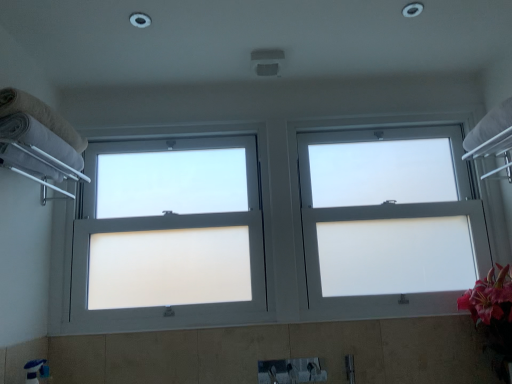
This screenshot has width=512, height=384. What are the coordinates of `white frosted glass window at center, the 2th window when ordered from left to right` in the screenshot? It's located at (392, 232).

Describe the element at coordinates (392, 232) in the screenshot. I see `white frosted glass window at center, the 2th window when ordered from left to right` at that location.

What do you see at coordinates (40, 115) in the screenshot? I see `beige cotton towel at left, positioned as the 2th towel in bottom-to-top order` at bounding box center [40, 115].

The height and width of the screenshot is (384, 512). I want to click on white frosted glass window at center, the 1th window viewed from the left, so click(170, 250).

At what (x,y) coordinates should I click in order to perform the action: click on white fluffy towel at left, the second towel from the top. Please return your answer as a coordinate pair (x, y). Looking at the image, I should click on (40, 140).

Is beige cotton towel at left, arranged as the 1th towel when viewed from the top, at the right side of white frosted glass window at center, which is the first window from right to left?

Incorrect, beige cotton towel at left, arranged as the 1th towel when viewed from the top, is not on the right side of white frosted glass window at center, which is the first window from right to left.

From a real-world perspective, is beige cotton towel at left, arranged as the 1th towel when viewed from the top, below white frosted glass window at center, the 2th window when ordered from left to right?

No, from a real-world perspective, beige cotton towel at left, arranged as the 1th towel when viewed from the top, is not below white frosted glass window at center, the 2th window when ordered from left to right.

Is point (60, 126) positioned in front of point (436, 184)?

Yes, it is.

Considering the sizes of objects beige cotton towel at left, arranged as the 1th towel when viewed from the top, and white frosted glass window at center, the 2th window when ordered from left to right, in the image provided, who is smaller, beige cotton towel at left, arranged as the 1th towel when viewed from the top, or white frosted glass window at center, the 2th window when ordered from left to right,?

With smaller size is beige cotton towel at left, arranged as the 1th towel when viewed from the top.

From the image's perspective, which one is positioned higher, white fluffy towel at left, the second towel from the top, or beige cotton towel at left, arranged as the 1th towel when viewed from the top?

beige cotton towel at left, arranged as the 1th towel when viewed from the top, from the image's perspective.

From a real-world perspective, is white fluffy towel at left, the first towel positioned from the bottom, over beige cotton towel at left, arranged as the 1th towel when viewed from the top?

No, from a real-world perspective, white fluffy towel at left, the first towel positioned from the bottom, is not over beige cotton towel at left, arranged as the 1th towel when viewed from the top

Considering the points (26, 137) and (10, 94), which point is in front, point (26, 137) or point (10, 94)?

The point (10, 94) is closer to the camera.

There is a beige cotton towel at left, arranged as the 1th towel when viewed from the top. Identify the location of the 1st window below it (from a real-world perspective). (170, 250).

Would you say beige cotton towel at left, arranged as the 1th towel when viewed from the top, is inside or outside white frosted glass window at center, the 1th window viewed from the left?

beige cotton towel at left, arranged as the 1th towel when viewed from the top, is not enclosed by white frosted glass window at center, the 1th window viewed from the left.

Based on their sizes in the image, would you say beige cotton towel at left, positioned as the 2th towel in bottom-to-top order, is bigger or smaller than white frosted glass window at center, the 1th window viewed from the left?

Clearly, beige cotton towel at left, positioned as the 2th towel in bottom-to-top order, is smaller in size than white frosted glass window at center, the 1th window viewed from the left.

Considering the positions of objects beige cotton towel at left, positioned as the 2th towel in bottom-to-top order, and white frosted glass window at center, the 1th window viewed from the left, in the image provided, who is in front, beige cotton towel at left, positioned as the 2th towel in bottom-to-top order, or white frosted glass window at center, the 1th window viewed from the left,?

beige cotton towel at left, positioned as the 2th towel in bottom-to-top order, is more forward.

This screenshot has width=512, height=384. What are the coordinates of `window lying below the white frosted glass window at center, the 2th window when ordered from left to right (from the image's perspective)` in the screenshot? It's located at (170, 250).

Could you tell me if white frosted glass window at center, which is the 2th window in right-to-left order, is turned towards white frosted glass window at center, the 2th window when ordered from left to right?

No.

Consider the image. From a real-world perspective, is white frosted glass window at center, which is the 2th window in right-to-left order, positioned above or below white frosted glass window at center, the 2th window when ordered from left to right?

From a real-world perspective, white frosted glass window at center, which is the 2th window in right-to-left order, is physically above white frosted glass window at center, the 2th window when ordered from left to right.

Is point (166, 265) positioned after point (387, 183)?

No, (166, 265) is in front of (387, 183).

Is there a large distance between white fluffy towel at left, the second towel from the top, and white frosted glass window at center, the 2th window when ordered from left to right?

Yes.

Considering the sizes of white fluffy towel at left, the first towel positioned from the bottom, and white frosted glass window at center, the 2th window when ordered from left to right, in the image, is white fluffy towel at left, the first towel positioned from the bottom, wider or thinner than white frosted glass window at center, the 2th window when ordered from left to right,?

white fluffy towel at left, the first towel positioned from the bottom, is wider than white frosted glass window at center, the 2th window when ordered from left to right.

Does white fluffy towel at left, the second towel from the top, appear on the left side of white frosted glass window at center, which is the first window from right to left?

Indeed, white fluffy towel at left, the second towel from the top, is positioned on the left side of white frosted glass window at center, which is the first window from right to left.

In the scene shown: Measure the distance from white fluffy towel at left, the first towel positioned from the bottom, to white frosted glass window at center, the 2th window when ordered from left to right.

white fluffy towel at left, the first towel positioned from the bottom, is 4.73 feet from white frosted glass window at center, the 2th window when ordered from left to right.

Which object is wider, white frosted glass window at center, the 1th window viewed from the left, or white fluffy towel at left, the first towel positioned from the bottom?

Wider between the two is white fluffy towel at left, the first towel positioned from the bottom.

Is white frosted glass window at center, which is the 2th window in right-to-left order, not inside white fluffy towel at left, the first towel positioned from the bottom?

Yes, white frosted glass window at center, which is the 2th window in right-to-left order, is located beyond the bounds of white fluffy towel at left, the first towel positioned from the bottom.

Looking at this image, what's the angular difference between beige cotton towel at left, arranged as the 1th towel when viewed from the top, and white fluffy towel at left, the first towel positioned from the bottom,'s facing directions?

There is a 0.0086-degree angle between the facing directions of beige cotton towel at left, arranged as the 1th towel when viewed from the top, and white fluffy towel at left, the first towel positioned from the bottom.

Is beige cotton towel at left, positioned as the 2th towel in bottom-to-top order, placed right next to white fluffy towel at left, the second towel from the top?

Yes, beige cotton towel at left, positioned as the 2th towel in bottom-to-top order, and white fluffy towel at left, the second towel from the top, clearly make contact.

Could you tell me if beige cotton towel at left, arranged as the 1th towel when viewed from the top, is facing white fluffy towel at left, the second towel from the top?

No, beige cotton towel at left, arranged as the 1th towel when viewed from the top, is not facing towards white fluffy towel at left, the second towel from the top.

Relative to white fluffy towel at left, the second towel from the top, is beige cotton towel at left, positioned as the 2th towel in bottom-to-top order, in front or behind?

beige cotton towel at left, positioned as the 2th towel in bottom-to-top order, is positioned closer to the viewer than white fluffy towel at left, the second towel from the top.

Image resolution: width=512 pixels, height=384 pixels. There is a white frosted glass window at center, the 2th window when ordered from left to right. Identify the location of the 2nd towel above it (from a real-world perspective). (40, 115).

Identify the location of towel behind the beige cotton towel at left, positioned as the 2th towel in bottom-to-top order. (40, 140).

Considering their positions, is white frosted glass window at center, which is the first window from right to left, positioned closer to white fluffy towel at left, the second towel from the top, than white frosted glass window at center, which is the 2th window in right-to-left order?

The object closer to white fluffy towel at left, the second towel from the top, is white frosted glass window at center, which is the 2th window in right-to-left order.

Which object lies nearer to the anchor point beige cotton towel at left, positioned as the 2th towel in bottom-to-top order, white fluffy towel at left, the first towel positioned from the bottom, or white frosted glass window at center, the 1th window viewed from the left?

Based on the image, white fluffy towel at left, the first towel positioned from the bottom, appears to be nearer to beige cotton towel at left, positioned as the 2th towel in bottom-to-top order.

From the image, which object appears to be farther from white frosted glass window at center, the 2th window when ordered from left to right, white fluffy towel at left, the first towel positioned from the bottom, or beige cotton towel at left, arranged as the 1th towel when viewed from the top?

beige cotton towel at left, arranged as the 1th towel when viewed from the top.

Based on their spatial positions, is beige cotton towel at left, positioned as the 2th towel in bottom-to-top order, or white frosted glass window at center, which is the 2th window in right-to-left order, closer to white frosted glass window at center, the 2th window when ordered from left to right?

Among the two, white frosted glass window at center, which is the 2th window in right-to-left order, is located nearer to white frosted glass window at center, the 2th window when ordered from left to right.

Estimate the real-world distances between objects in this image. Which object is closer to white frosted glass window at center, the 2th window when ordered from left to right, white frosted glass window at center, the 1th window viewed from the left, or beige cotton towel at left, arranged as the 1th towel when viewed from the top?

white frosted glass window at center, the 1th window viewed from the left.

When comparing their distances from white frosted glass window at center, the 2th window when ordered from left to right, does white frosted glass window at center, the 1th window viewed from the left, or white fluffy towel at left, the second towel from the top, seem further?

white fluffy towel at left, the second towel from the top, is further to white frosted glass window at center, the 2th window when ordered from left to right.

Based on their spatial positions, is white fluffy towel at left, the first towel positioned from the bottom, or white frosted glass window at center, the 1th window viewed from the left, closer to white frosted glass window at center, which is the first window from right to left?

white frosted glass window at center, the 1th window viewed from the left, lies closer to white frosted glass window at center, which is the first window from right to left, than the other object.

From the image, which object appears to be nearer to white fluffy towel at left, the first towel positioned from the bottom, beige cotton towel at left, arranged as the 1th towel when viewed from the top, or white frosted glass window at center, which is the 2th window in right-to-left order?

Among the two, beige cotton towel at left, arranged as the 1th towel when viewed from the top, is located nearer to white fluffy towel at left, the first towel positioned from the bottom.

I want to click on window between white fluffy towel at left, the first towel positioned from the bottom, and white frosted glass window at center, which is the first window from right to left, so click(170, 250).

Image resolution: width=512 pixels, height=384 pixels. Find the location of `window situated between beige cotton towel at left, positioned as the 2th towel in bottom-to-top order, and white frosted glass window at center, which is the first window from right to left, from left to right`. window situated between beige cotton towel at left, positioned as the 2th towel in bottom-to-top order, and white frosted glass window at center, which is the first window from right to left, from left to right is located at coordinates (x=170, y=250).

Identify the location of towel positioned between beige cotton towel at left, positioned as the 2th towel in bottom-to-top order, and white frosted glass window at center, the 1th window viewed from the left, from near to far. Image resolution: width=512 pixels, height=384 pixels. (40, 140).

Where is `towel between beige cotton towel at left, arranged as the 1th towel when viewed from the top, and white frosted glass window at center, the 2th window when ordered from left to right, from left to right`? This screenshot has height=384, width=512. towel between beige cotton towel at left, arranged as the 1th towel when viewed from the top, and white frosted glass window at center, the 2th window when ordered from left to right, from left to right is located at coordinates (40, 140).